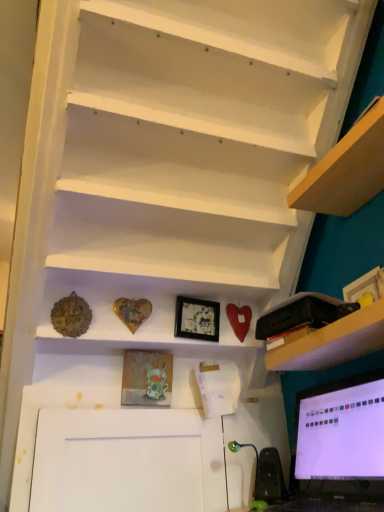
Question: Considering the positions of green rubber speaker at lower right and white matte stairs at upper center in the image, is green rubber speaker at lower right bigger or smaller than white matte stairs at upper center?

Choices:
 (A) big
 (B) small

Answer: (B)

Question: From a real-world perspective, is green rubber speaker at lower right positioned above or below white matte stairs at upper center?

Choices:
 (A) above
 (B) below

Answer: (B)

Question: Which object is positioned closest to the green rubber speaker at lower right?

Choices:
 (A) black glossy picture frame at center, acting as the 2th picture frame starting from the bottom
 (B) wooden textured picture frame at center, which appears as the second picture frame when viewed from the right
 (C) white matte stairs at upper center
 (D) wooden heart at center
 (E) black plastic bag at upper right

Answer: (B)

Question: Which is nearer to the wooden heart at center?

Choices:
 (A) matte black monitor at lower right
 (B) green rubber speaker at lower right
 (C) black glossy picture frame at center, arranged as the 1th picture frame when viewed from the right
 (D) white matte stairs at upper center
 (E) black plastic bag at upper right

Answer: (C)